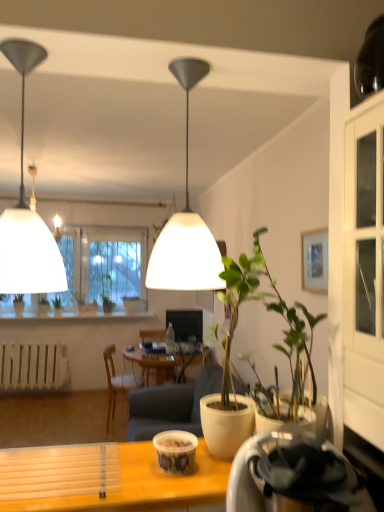
The image size is (384, 512). I want to click on vacant region above matte white lampshade at upper left, which ranks as the second lamp in right-to-left order (from a real-world perspective), so click(34, 44).